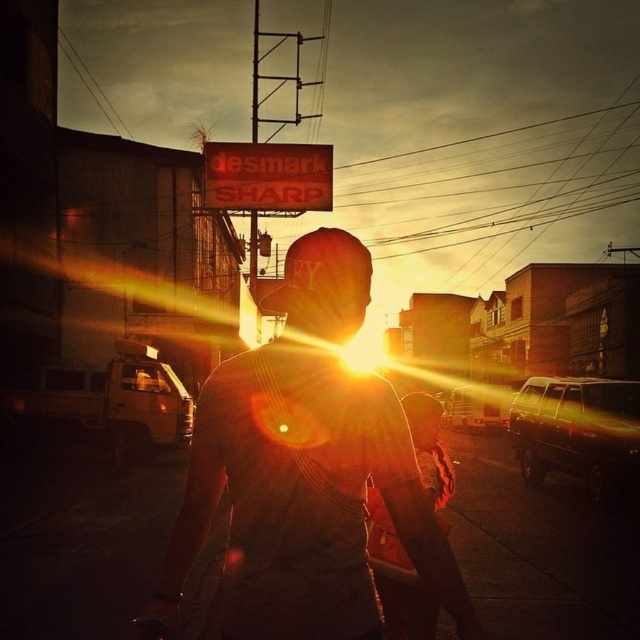
You are standing at the point marked as point (198,522) in the image. You want to walk towards the sun to take a photo. Given that the distance from you to the viewer is 6.66 feet, can you estimate how far you need to walk to reach the sun?

The distance of point (198,522) from viewer is 6.66 feet. Since the sun is positioned directly behind the person in the image, you would need to walk away from your current position towards the direction the person is facing to reach the sun. However, the actual distance to the sun is astronomical and cannot be measured in feet. The 6.66 feet refers to your distance from the viewer in the image, not the sun.